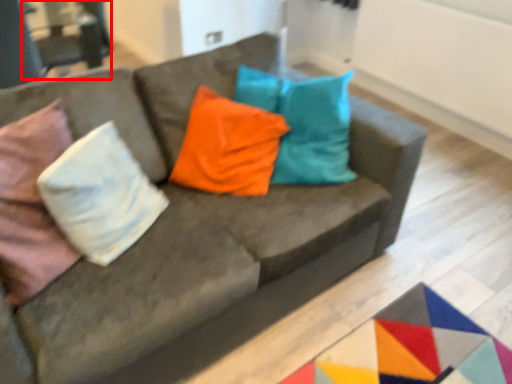
Question: From the image's perspective, what is the correct spatial positioning of armchair (annotated by the red box) in reference to pillow?

Choices:
 (A) below
 (B) above

Answer: (B)